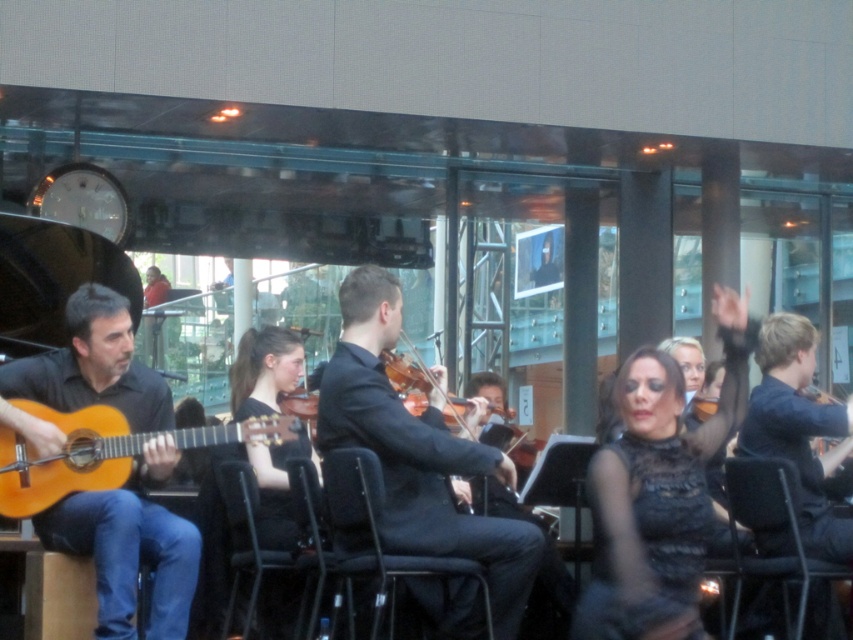
Question: Is matte black guitar at left closer to the viewer compared to black plastic chair at lower right?

Choices:
 (A) no
 (B) yes

Answer: (B)

Question: Does black smooth suit at center lie in front of black plastic chair at lower right?

Choices:
 (A) yes
 (B) no

Answer: (A)

Question: Which object is positioned closest to the matte black guitar at left?

Choices:
 (A) wooden violin at center
 (B) black plastic chair at center

Answer: (B)

Question: Among these objects, which one is nearest to the camera?

Choices:
 (A) light brown wood guitar at left
 (B) black plastic chair at center

Answer: (A)

Question: In this image, where is black smooth suit at center located relative to black plastic chair at center?

Choices:
 (A) left
 (B) right

Answer: (B)

Question: Which point is closer to the camera?

Choices:
 (A) (39, 465)
 (B) (801, 392)
 (C) (59, 362)

Answer: (A)